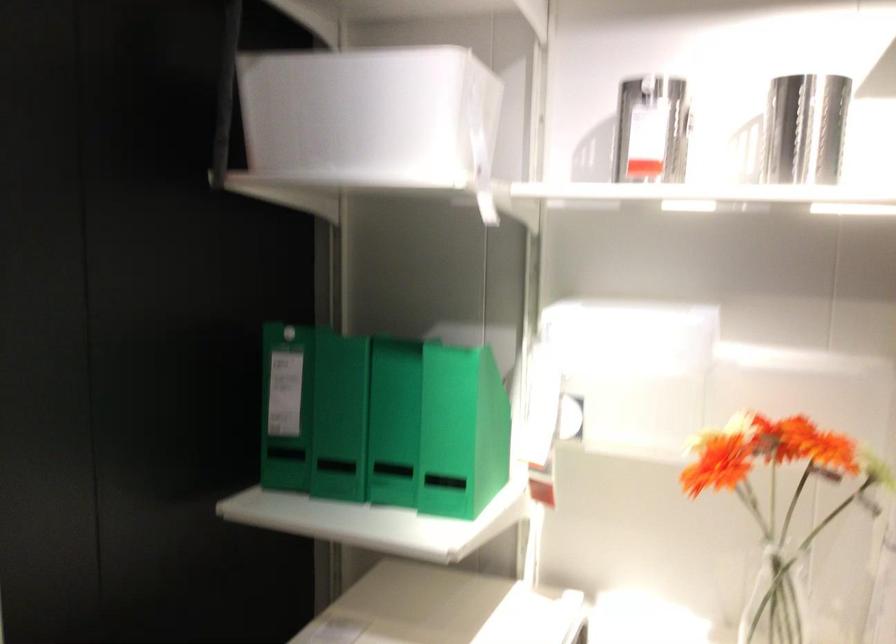
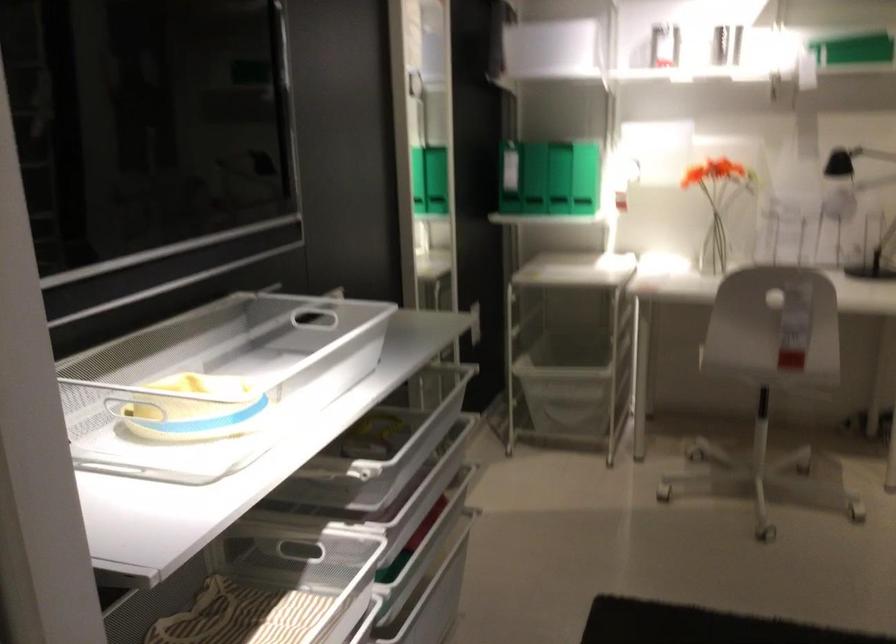
The point at (378, 144) is marked in the first image. Where is the corresponding point in the second image?

(556, 46)